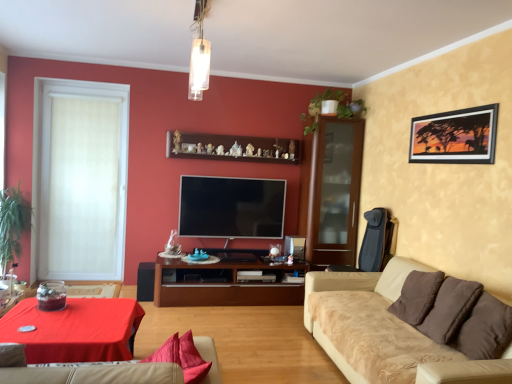
This screenshot has width=512, height=384. Find the location of `free region under silk matte painting at upper right (from a real-world perspective)`. free region under silk matte painting at upper right (from a real-world perspective) is located at coordinates (434, 265).